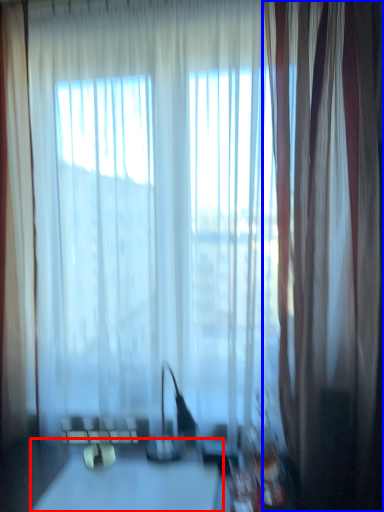
Question: Among these objects, which one is nearest to the camera, table (highlighted by a red box) or curtain (highlighted by a blue box)?

Choices:
 (A) table
 (B) curtain

Answer: (A)